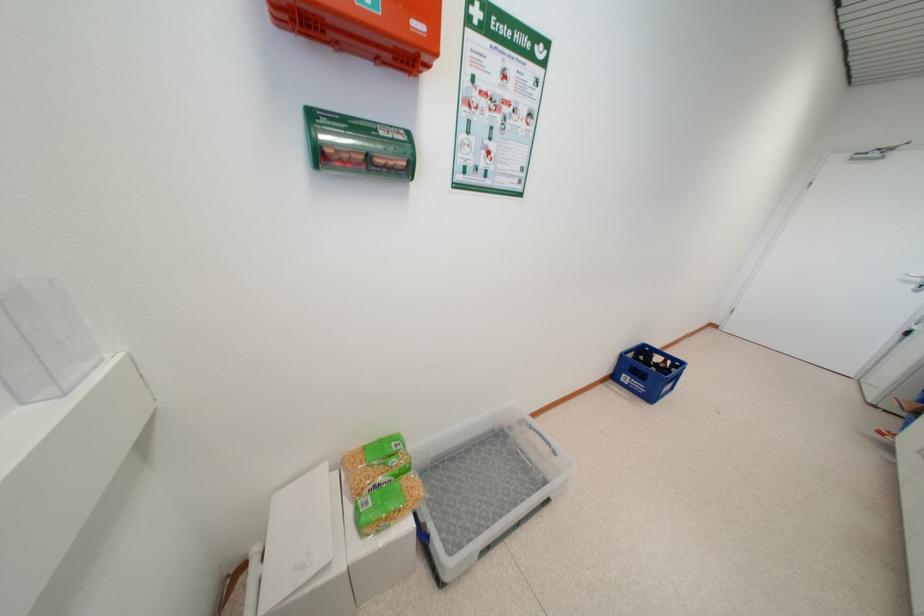
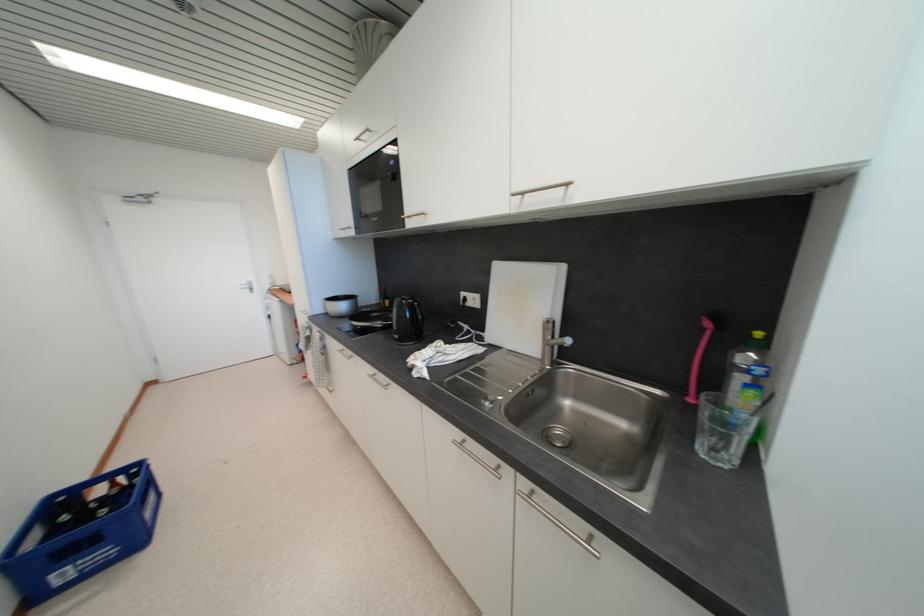
The point at (669, 363) is marked in the first image. Where is the corresponding point in the second image?

(118, 487)